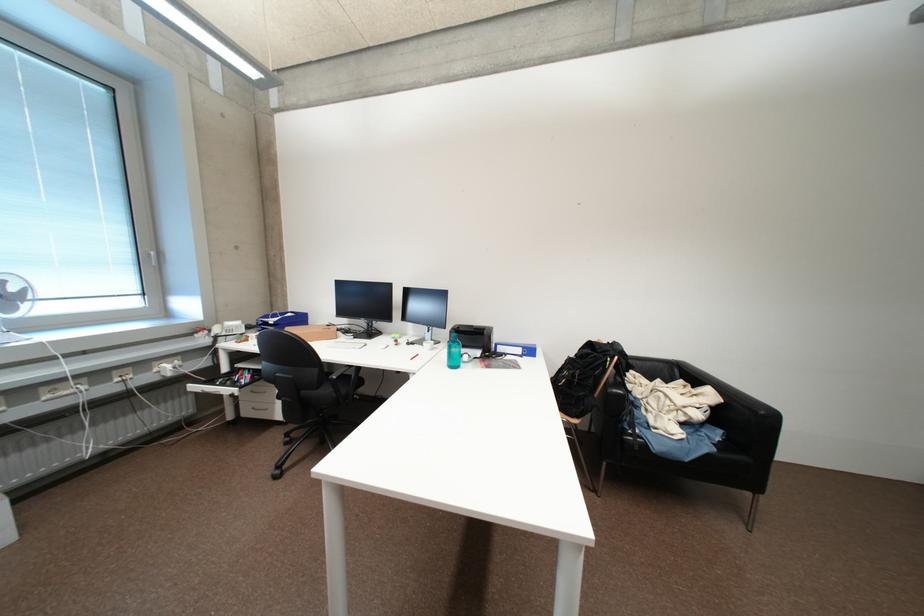
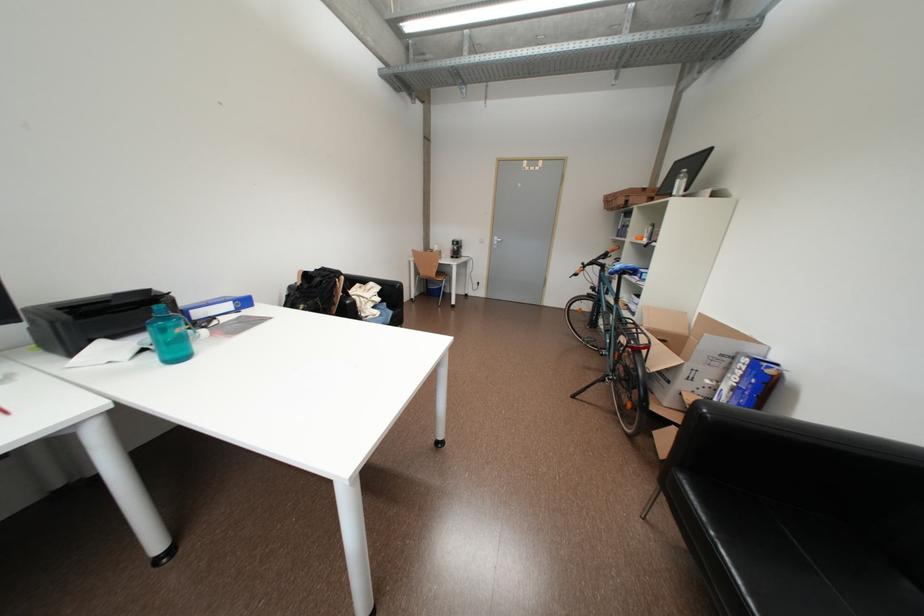
The images are taken continuously from a first-person perspective. In which direction is your viewpoint rotating?

The rotation direction of the camera is right-down.